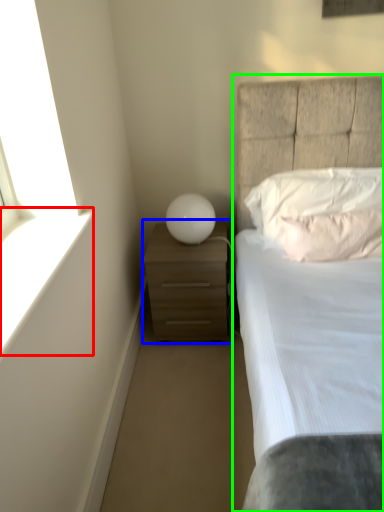
Question: Based on their relative distances, which object is farther from window sill (highlighted by a red box)? Choose from nightstand (highlighted by a blue box) and bed (highlighted by a green box).

Choices:
 (A) nightstand
 (B) bed

Answer: (B)